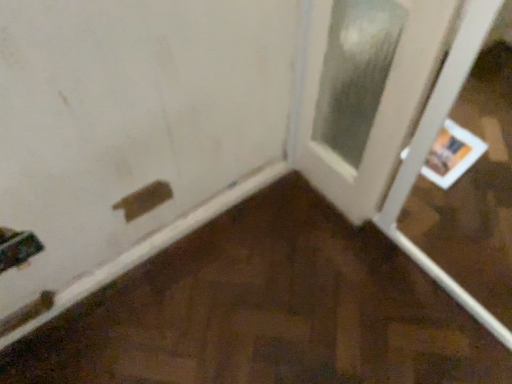
Question: Is white glossy door at right, which is the first door from right to left, to the left or to the right of brown matte plywood at lower left in the image?

Choices:
 (A) left
 (B) right

Answer: (B)

Question: In terms of width, does white glossy door at right, which is the first door from right to left, look wider or thinner when compared to brown matte plywood at lower left?

Choices:
 (A) wide
 (B) thin

Answer: (A)

Question: Which of these objects is positioned closest to the matte white door at lower left, arranged as the first door when viewed from the left?

Choices:
 (A) white glossy door at right, which is the first door from right to left
 (B) brown matte plywood at lower left

Answer: (A)

Question: Considering the real-world distances, which object is closest to the white glossy door at right, which is counted as the 2th door, starting from the left?

Choices:
 (A) brown matte plywood at lower left
 (B) matte white door at lower left, arranged as the first door when viewed from the left

Answer: (B)